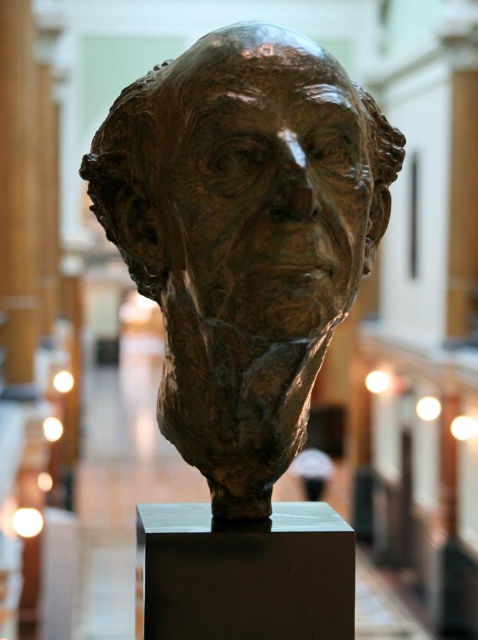
Find the location of `bronze sculpture at center`. bronze sculpture at center is located at coordinates (247, 180).

Locate an element on the screen. The width and height of the screenshot is (478, 640). bronze sculpture at center is located at coordinates (247, 180).